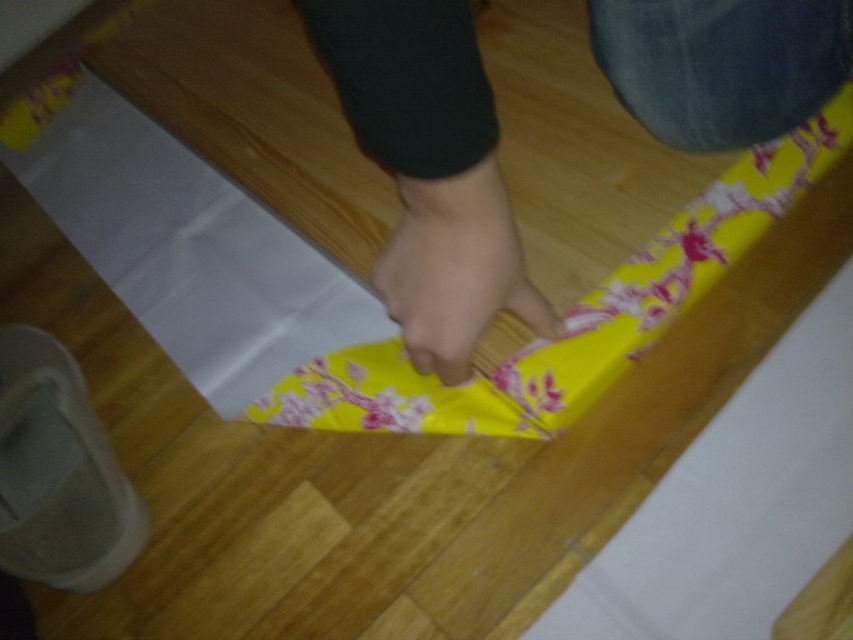
You are trying to locate the yellow floral fabric at center in the image. According to the coordinates provided, where exactly is it positioned?

The yellow floral fabric at center is located at point [430,170].

You are a craft assistant trying to help someone wrap a gift. You see the yellow floral fabric at center and the smooth skin hand at center. Which object is located to the right of the other?

The yellow floral fabric at center is positioned on the right side of smooth skin hand at center, so the yellow floral fabric at center is to the right of the smooth skin hand at center.

You are trying to wrap a gift and need to know if the yellow floral fabric at center can cover your smooth skin hand at center completely. Based on the scene, can it?

The yellow floral fabric at center might be wider than smooth skin hand at center, so it could potentially cover it completely depending on the exact dimensions.